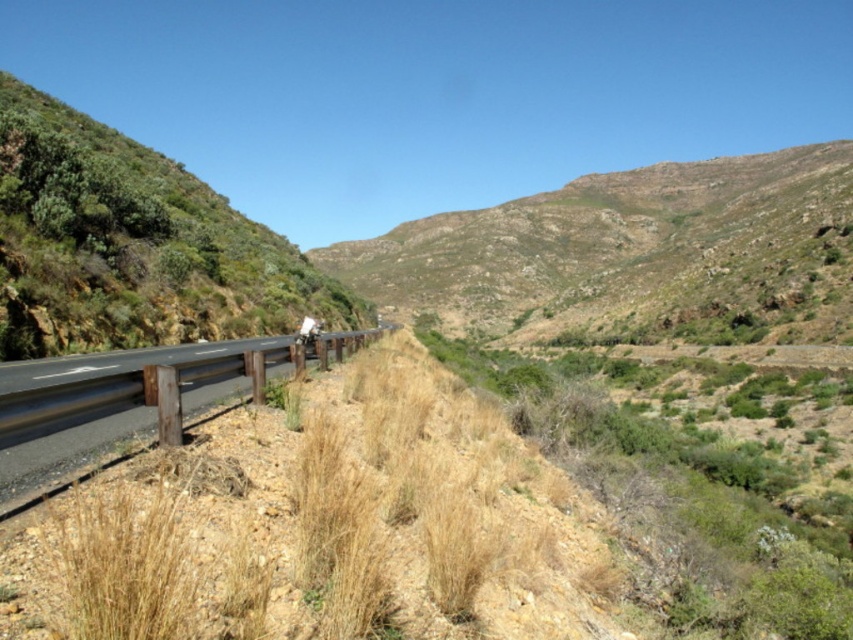
You are driving along the asphalt road at lower left and want to park your car on the green grassy hillside at center. Is the hillside above or below the road?

The green grassy hillside at center is located above the asphalt road at lower left, so it is higher than the road. However, parking on the hillside may not be feasible due to its slope and the presence of grass, which might make it unstable for parking.

You are driving a car and see the green grassy hillside at center and the asphalt road at lower left. Which one is closer to you?

The asphalt road at lower left is closer to you because the green grassy hillside at center is further away.